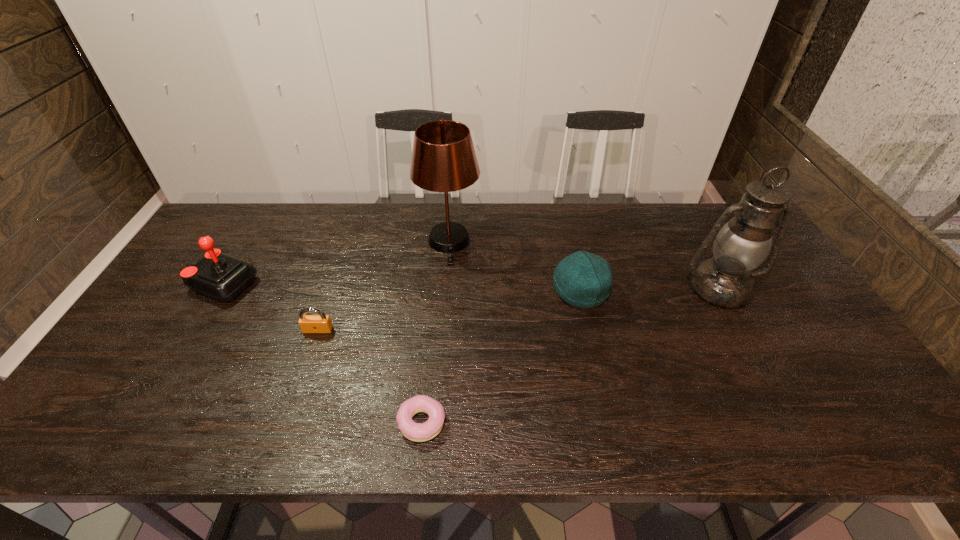
Identify the location of free spot between the beanie and the leftmost object. The width and height of the screenshot is (960, 540). (400, 287).

Find the location of `object that can be found as the second closest to the third shortest object`. object that can be found as the second closest to the third shortest object is located at coordinates point(443,159).

Point out which object is positioned as the nearest to the fifth farthest object. Please provide its 2D coordinates. Your answer should be formatted as a tuple, i.e. [(x, y)], where the tuple contains the x and y coordinates of a point satisfying the conditions above.

[(220, 276)]

What are the coordinates of `free location that satisfies the following two spatial constraints: 1. on the front side of the shortest object; 2. on the left side of the joystick` in the screenshot? It's located at (138, 422).

The height and width of the screenshot is (540, 960). Find the location of `free space that satisfies the following two spatial constraints: 1. on the front-facing side of the fourth tallest object; 2. on the right side of the lampshade`. free space that satisfies the following two spatial constraints: 1. on the front-facing side of the fourth tallest object; 2. on the right side of the lampshade is located at coordinates (445, 291).

You are a GUI agent. You are given a task and a screenshot of the screen. Output one action in this format:
    pyautogui.click(x=<x>, y=<y>)
    Task: Click on the free space that satisfies the following two spatial constraints: 1. on the front-facing side of the lampshade; 2. on the left side of the rightmost object
    This screenshot has height=540, width=960.
    Given the screenshot: What is the action you would take?
    pyautogui.click(x=445, y=288)

Locate an element on the screen. This screenshot has width=960, height=540. blank area in the image that satisfies the following two spatial constraints: 1. to unlock the padlock from the front; 2. on the left side of the shortest object is located at coordinates (287, 422).